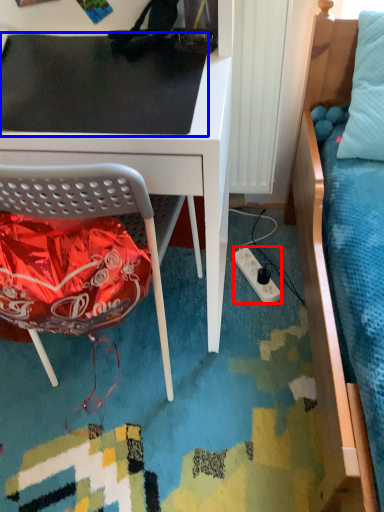
Question: Which point is closer to the camera, power outlet (highlighted by a red box) or table top (highlighted by a blue box)?

Choices:
 (A) power outlet
 (B) table top

Answer: (B)